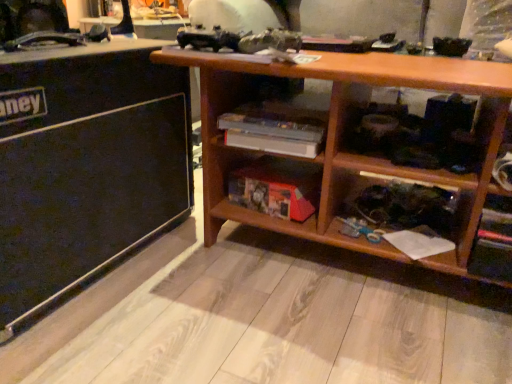
Question: From a real-world perspective, is black matte speaker at left positioned over wooden bookshelf at lower center based on gravity?

Choices:
 (A) no
 (B) yes

Answer: (B)

Question: Is wooden bookshelf at lower center inside black matte speaker at left?

Choices:
 (A) yes
 (B) no

Answer: (B)

Question: From a real-world perspective, is black matte speaker at left under wooden bookshelf at lower center?

Choices:
 (A) yes
 (B) no

Answer: (B)

Question: From the image's perspective, would you say black matte speaker at left is shown under wooden bookshelf at lower center?

Choices:
 (A) yes
 (B) no

Answer: (B)

Question: Is black matte speaker at left positioned beyond the bounds of wooden bookshelf at lower center?

Choices:
 (A) no
 (B) yes

Answer: (B)

Question: From the image's perspective, is black matte speaker at left positioned above or below wooden bookshelf at lower center?

Choices:
 (A) above
 (B) below

Answer: (A)

Question: Is black matte speaker at left inside the boundaries of wooden bookshelf at lower center, or outside?

Choices:
 (A) outside
 (B) inside

Answer: (A)

Question: From their relative heights in the image, would you say black matte speaker at left is taller or shorter than wooden bookshelf at lower center?

Choices:
 (A) short
 (B) tall

Answer: (B)

Question: From a real-world perspective, is black matte speaker at left positioned above or below wooden bookshelf at lower center?

Choices:
 (A) above
 (B) below

Answer: (A)

Question: Considering the positions of wooden bookshelf at lower center and wooden shelf at center in the image, is wooden bookshelf at lower center bigger or smaller than wooden shelf at center?

Choices:
 (A) big
 (B) small

Answer: (B)

Question: Is wooden bookshelf at lower center taller or shorter than wooden shelf at center?

Choices:
 (A) short
 (B) tall

Answer: (A)

Question: Considering their positions, is wooden bookshelf at lower center located in front of or behind wooden shelf at center?

Choices:
 (A) front
 (B) behind

Answer: (B)

Question: Do you think wooden bookshelf at lower center is within wooden shelf at center, or outside of it?

Choices:
 (A) inside
 (B) outside

Answer: (B)

Question: Which is correct: black matte speaker at left is inside wooden shelf at center, or outside of it?

Choices:
 (A) outside
 (B) inside

Answer: (A)

Question: From the image's perspective, is black matte speaker at left positioned above or below wooden shelf at center?

Choices:
 (A) below
 (B) above

Answer: (A)